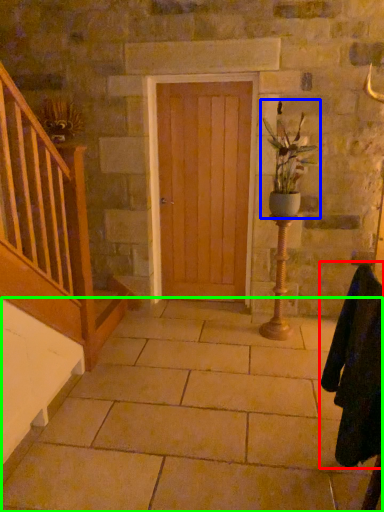
Question: Estimate the real-world distances between objects in this image. Which object is farther from robe (highlighted by a red box), houseplant (highlighted by a blue box) or concrete (highlighted by a green box)?

Choices:
 (A) houseplant
 (B) concrete

Answer: (A)